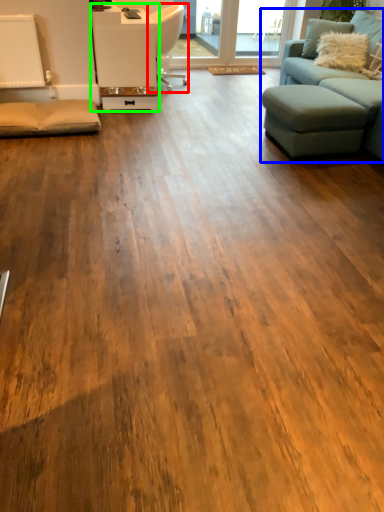
Question: Considering the real-world distances, which object is farthest from chair (highlighted by a red box)? studio couch (highlighted by a blue box) or table (highlighted by a green box)?

Choices:
 (A) studio couch
 (B) table

Answer: (A)